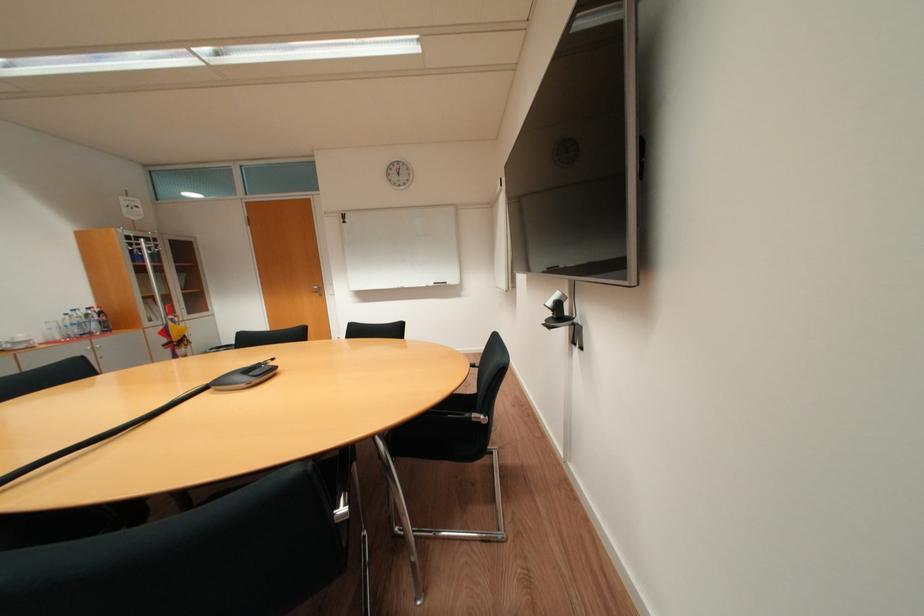
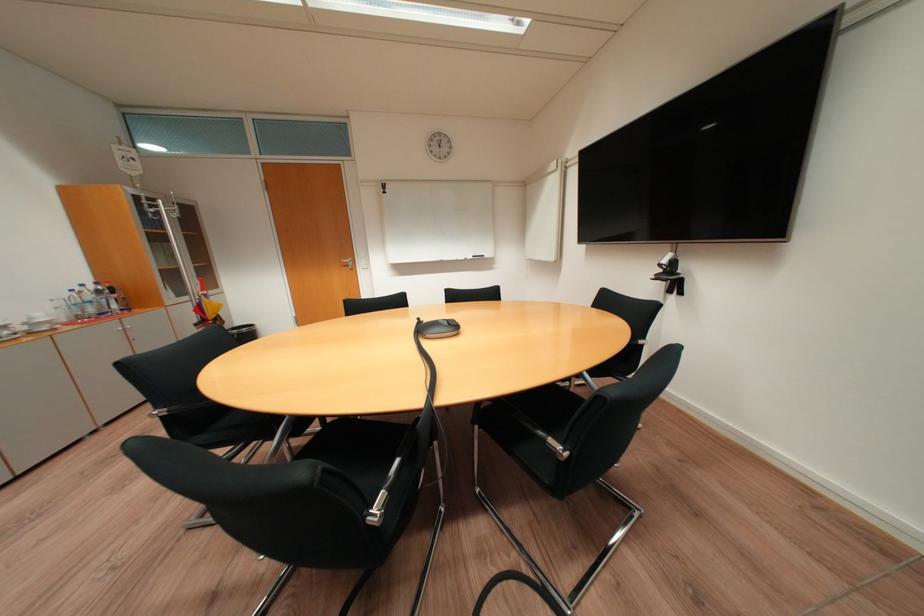
Locate, in the second image, the point that corresponds to (x=92, y=313) in the first image.

(101, 288)